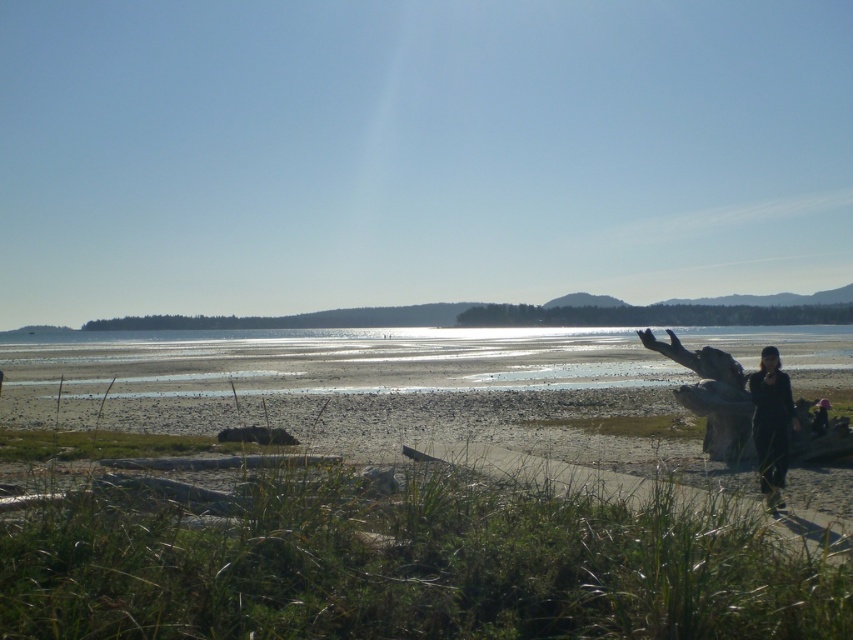
Question: Is clear sand at lower center above black matte clothing at lower right?

Choices:
 (A) yes
 (B) no

Answer: (B)

Question: Which object is the closest to the smooth sand beach at lower right?

Choices:
 (A) black matte clothing at lower right
 (B) clear sand at lower center

Answer: (B)

Question: Is clear sand at lower center smaller than black matte clothing at lower right?

Choices:
 (A) yes
 (B) no

Answer: (B)

Question: In this image, where is clear sand at lower center located relative to black matte clothing at lower right?

Choices:
 (A) above
 (B) below

Answer: (B)

Question: Among these objects, which one is farthest from the camera?

Choices:
 (A) black matte clothing at lower right
 (B) clear sand at lower center

Answer: (B)

Question: Which point appears closest to the camera in this image?

Choices:
 (A) click(x=759, y=368)
 (B) click(x=68, y=403)

Answer: (A)